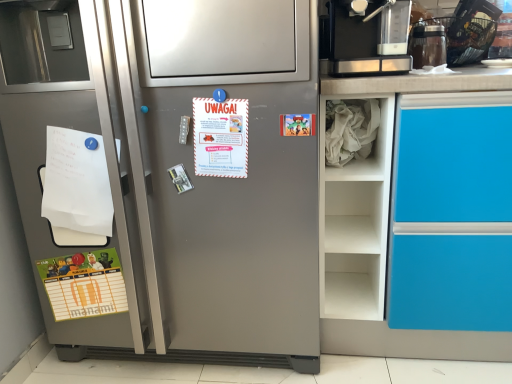
Question: Looking at the image, does satin silver refrigerator at left seem bigger or smaller compared to white crumpled paper at right?

Choices:
 (A) small
 (B) big

Answer: (B)

Question: From a real-world perspective, is satin silver refrigerator at left above or below white crumpled paper at right?

Choices:
 (A) above
 (B) below

Answer: (B)

Question: Which object is the closest to the satin silver refrigerator at left?

Choices:
 (A) transparent plastic container at upper right, the first appliance viewed from the left
 (B) green matte poster at lower left, which ranks as the first postcard in back-to-front order
 (C) white paper at left
 (D) black plastic basket at upper right, which is counted as the 1th appliance, starting from the right
 (E) white crumpled paper at right

Answer: (C)

Question: Based on their relative distances, which object is nearer to the green matte poster at lower left, the 3th postcard in the front-to-back sequence?

Choices:
 (A) white paper at center, which ranks as the second postcard in top-to-bottom order
 (B) black plastic basket at upper right, which is counted as the 1th appliance, starting from the right
 (C) cartoon paper at upper right, marked as the 2th postcard in a front-to-back arrangement
 (D) white crumpled paper at right
 (E) white paper at left

Answer: (E)